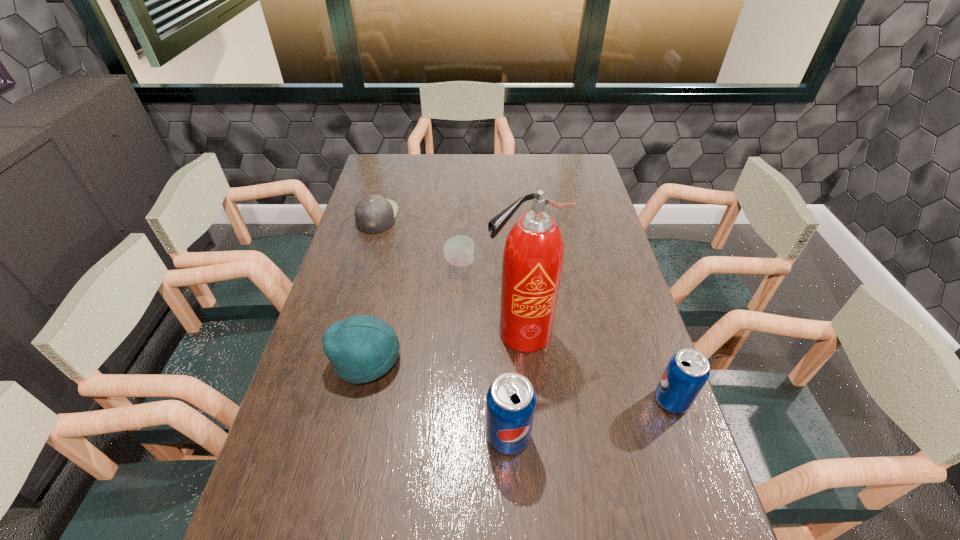
At what (x,y) coordinates should I click in order to perform the action: click on vacant space at the left edge of the desktop. Please return your answer as a coordinate pair (x, y). This screenshot has width=960, height=540. Looking at the image, I should click on (357, 261).

In the image, there is a desktop. At what (x,y) coordinates should I click in order to perform the action: click on vacant space at the right edge. Please return your answer as a coordinate pair (x, y). Image resolution: width=960 pixels, height=540 pixels. Looking at the image, I should click on (590, 247).

At what (x,y) coordinates should I click in order to perform the action: click on vacant region at the far right corner of the desktop. Please return your answer as a coordinate pair (x, y). The height and width of the screenshot is (540, 960). Looking at the image, I should click on (563, 177).

This screenshot has height=540, width=960. I want to click on vacant area that lies between the shorter pop soda and the left pop soda, so click(589, 418).

Identify the location of empty location between the shorter pop soda and the tallest object. (596, 367).

The width and height of the screenshot is (960, 540). Find the location of `vacant space that is in between the beanie and the tallest object`. vacant space that is in between the beanie and the tallest object is located at coordinates (444, 346).

I want to click on free spot between the farthest object and the third shortest object, so click(372, 288).

This screenshot has width=960, height=540. I want to click on free spot between the fourth object from right to left and the farthest object, so click(419, 239).

Locate an element on the screen. This screenshot has height=540, width=960. free space between the farthest object and the beanie is located at coordinates (372, 288).

Find the location of `free space that is in between the tallest object and the cap`. free space that is in between the tallest object and the cap is located at coordinates (449, 275).